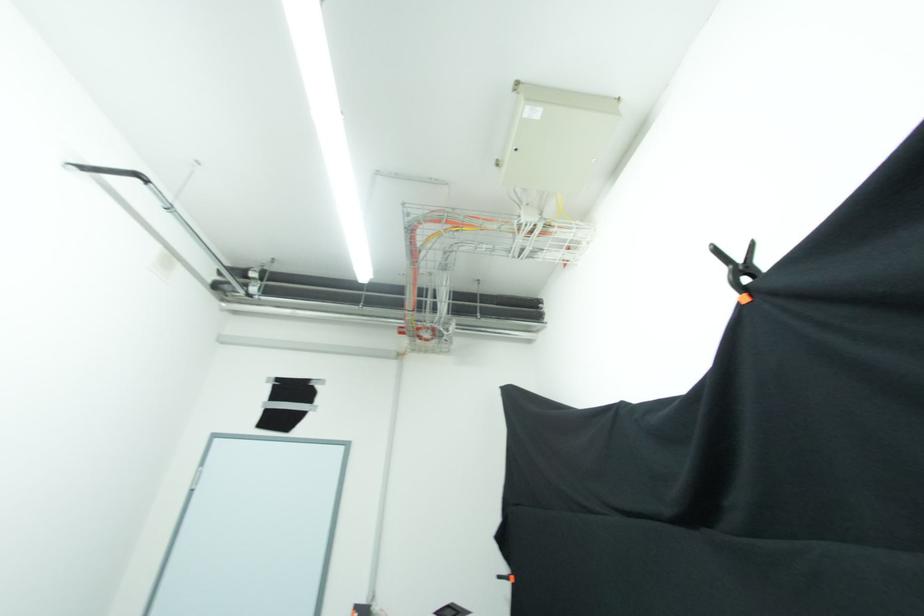
What do you see at coordinates (738, 270) in the screenshot?
I see `a black grip handle` at bounding box center [738, 270].